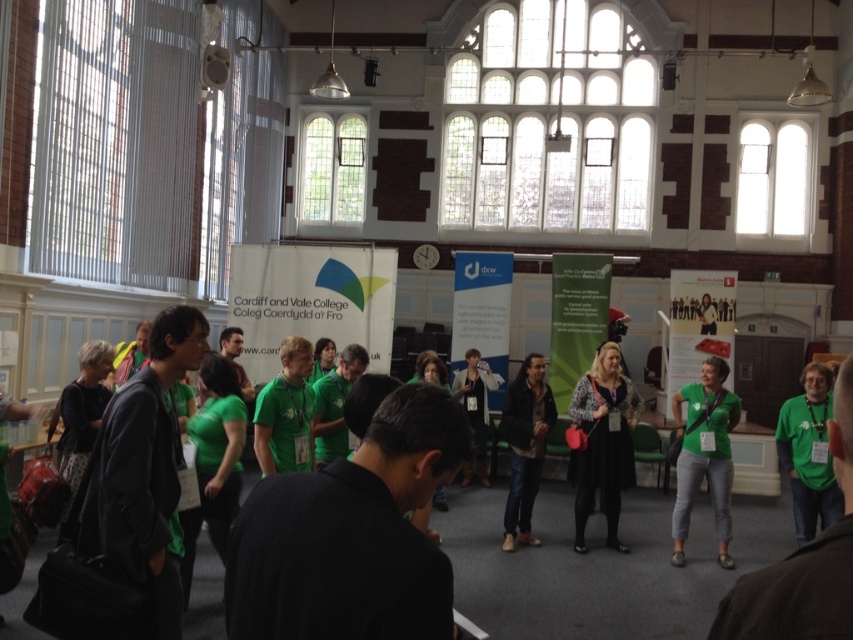
Question: Does leopard print sweater at center come in front of green matte shirt at center?

Choices:
 (A) no
 (B) yes

Answer: (A)

Question: Can you confirm if leopard print sweater at center is positioned to the left of green matte shirt at center?

Choices:
 (A) yes
 (B) no

Answer: (A)

Question: Which of these objects is positioned farthest from the leather jacket at center?

Choices:
 (A) leopard print sweater at center
 (B) green matte shirt at center

Answer: (B)

Question: Does leopard print sweater at center appear on the right side of leather jacket at center?

Choices:
 (A) no
 (B) yes

Answer: (B)

Question: Which object appears farthest from the camera in this image?

Choices:
 (A) green matte shirt at center
 (B) leather jacket at center

Answer: (B)

Question: Which of these objects is positioned closest to the green matte shirt at center?

Choices:
 (A) leather jacket at center
 (B) leopard print sweater at center

Answer: (B)